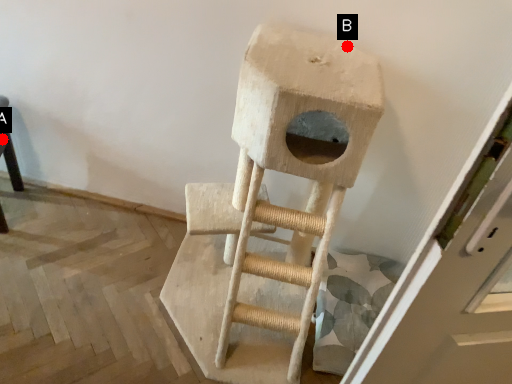
Question: Two points are circled on the image, labeled by A and B beside each circle. Which point is farther from the camera taking this photo?

Choices:
 (A) A is further
 (B) B is further

Answer: (A)